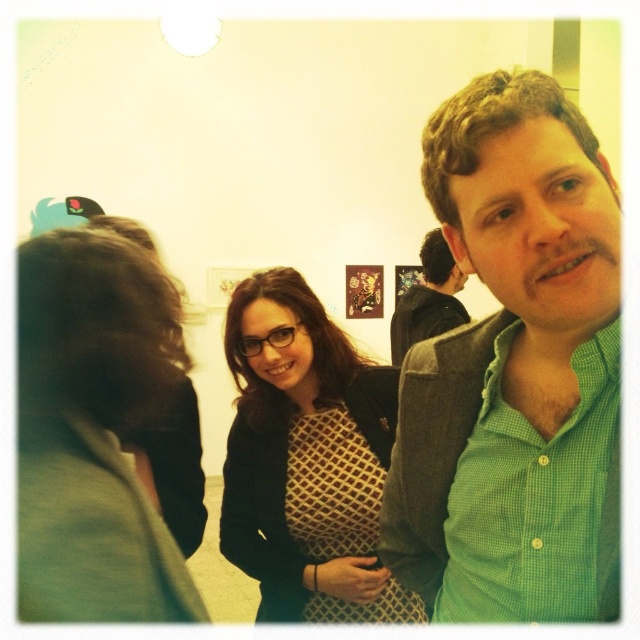
Based on the photo, who is higher up, dark brown hair at left or green checkered shirt at right?

green checkered shirt at right

Which is below, dark brown hair at left or green checkered shirt at right?

dark brown hair at left is lower down.

Where is `dark brown hair at left`? dark brown hair at left is located at coordinates (93, 432).

The image size is (640, 640). Identify the location of dark brown hair at left. (93, 432).

Consider the image. Does green checkered shirt at center have a lesser height compared to green checkered shirt at right?

In fact, green checkered shirt at center may be taller than green checkered shirt at right.

Which is more to the left, green checkered shirt at center or green checkered shirt at right?

From the viewer's perspective, green checkered shirt at center appears more on the left side.

The width and height of the screenshot is (640, 640). Identify the location of green checkered shirt at center. (515, 371).

Find the location of a particular element. This screenshot has height=640, width=640. green checkered shirt at center is located at coordinates (515, 371).

Which is behind, point (612, 307) or point (109, 502)?

Positioned behind is point (612, 307).

Find the location of a particular element. This screenshot has height=640, width=640. green checkered shirt at center is located at coordinates (515, 371).